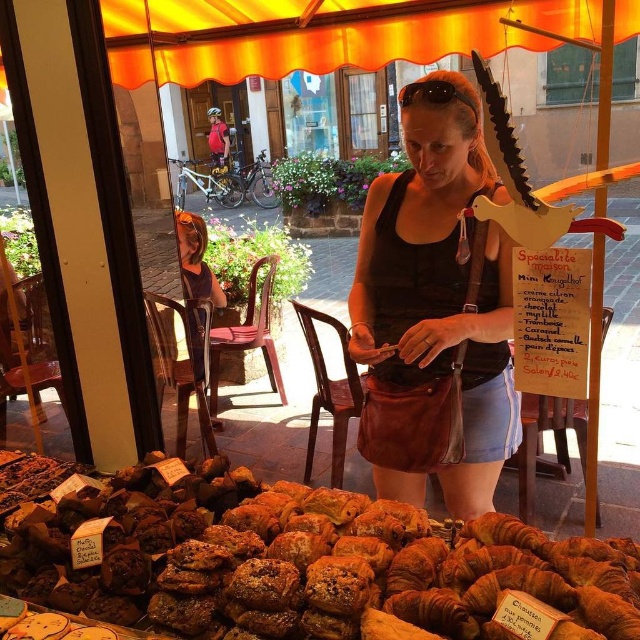
You are a customer at the bakery and you want to sit down while waiting for your order. There is an orange fabric chair at lower left and a matte black tank top at center. Which one is shorter so you can sit on it?

The orange fabric chair at lower left is shorter than the matte black tank top at center, so you can sit on the orange fabric chair at lower left.